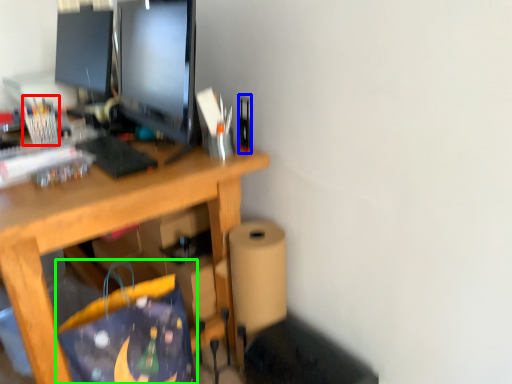
Question: Which object is positioned closest to stationery (highlighted by a red box)? Select from stationery (highlighted by a blue box) and shopping bag (highlighted by a green box).

Choices:
 (A) stationery
 (B) shopping bag

Answer: (B)